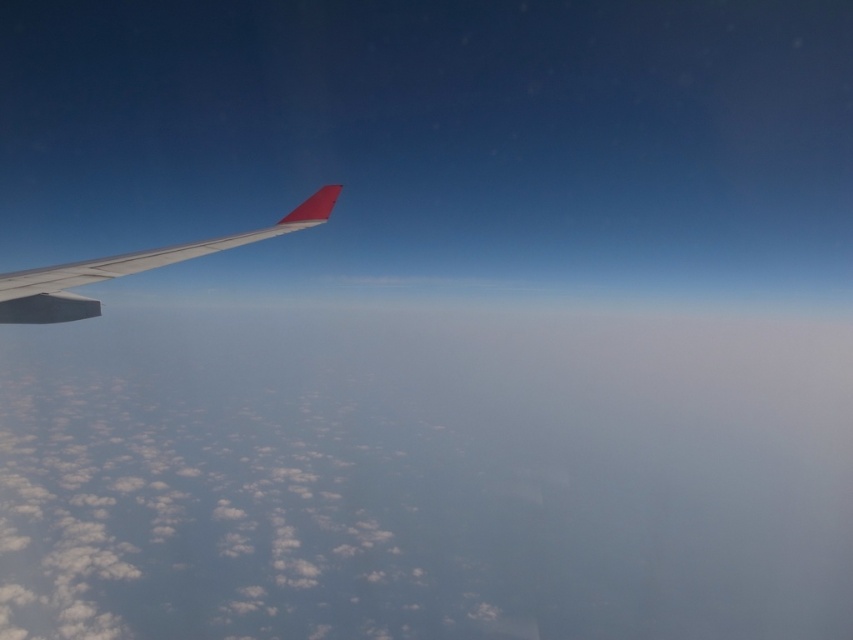
Question: Among these points, which one is farthest from the camera?

Choices:
 (A) (251, 230)
 (B) (367, 310)

Answer: (B)

Question: Is white fluffy cloud at lower left further to the viewer compared to metallic gray wing at left?

Choices:
 (A) no
 (B) yes

Answer: (B)

Question: Is white fluffy cloud at lower left smaller than metallic gray wing at left?

Choices:
 (A) yes
 (B) no

Answer: (B)

Question: Does white fluffy cloud at lower left have a smaller size compared to metallic gray wing at left?

Choices:
 (A) yes
 (B) no

Answer: (B)